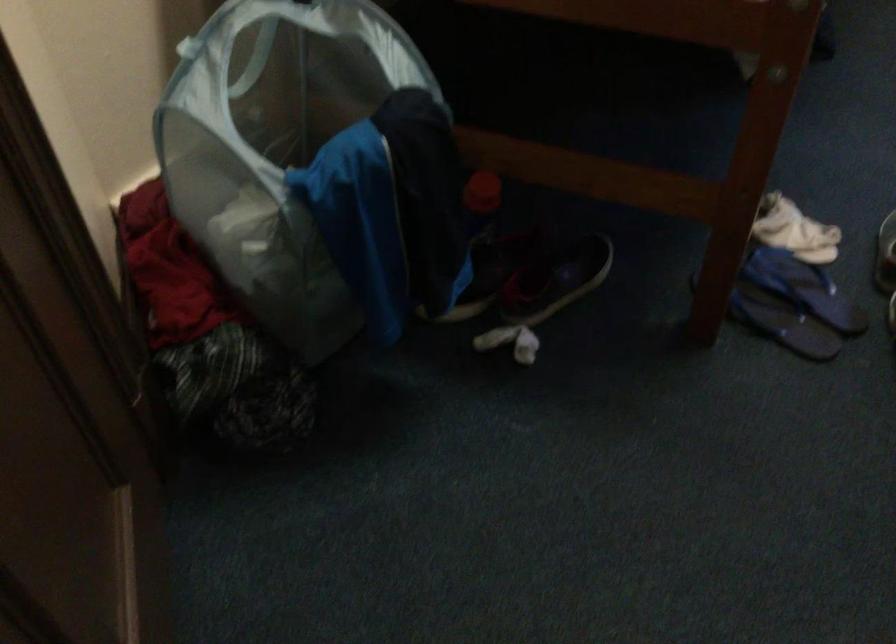
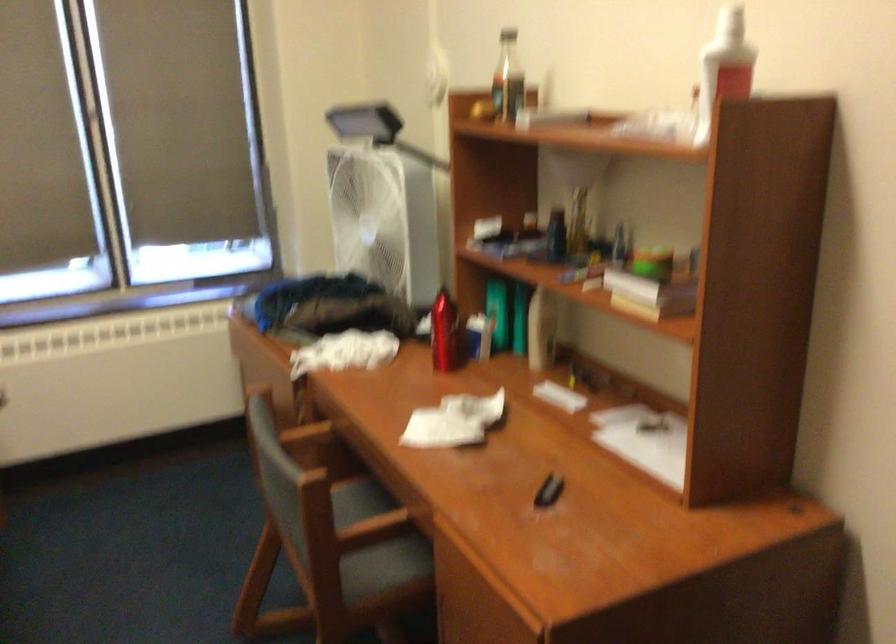
Question: The images are taken continuously from a first-person perspective. In which direction is your viewpoint rotating?

Choices:
 (A) Left
 (B) Right
 (C) Up
 (D) Down

Answer: (B)